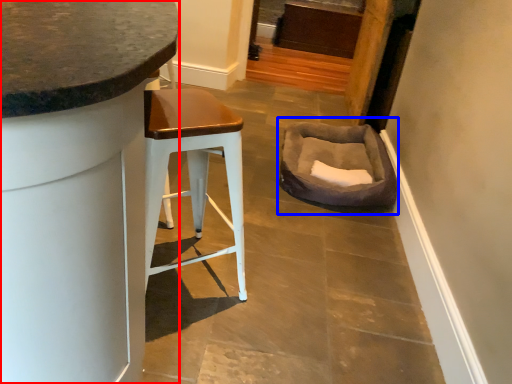
Question: Which object appears farthest to the camera in this image, cabinetry (highlighted by a red box) or bean bag chair (highlighted by a blue box)?

Choices:
 (A) cabinetry
 (B) bean bag chair

Answer: (B)